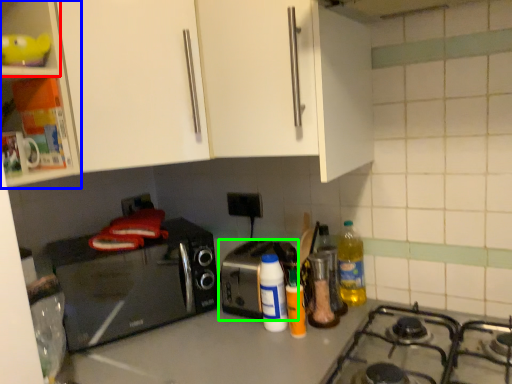
Question: Which object is the closest to the shelf (highlighted by a red box)? Choose among these: cabinetry (highlighted by a blue box) or toaster (highlighted by a green box).

Choices:
 (A) cabinetry
 (B) toaster

Answer: (A)